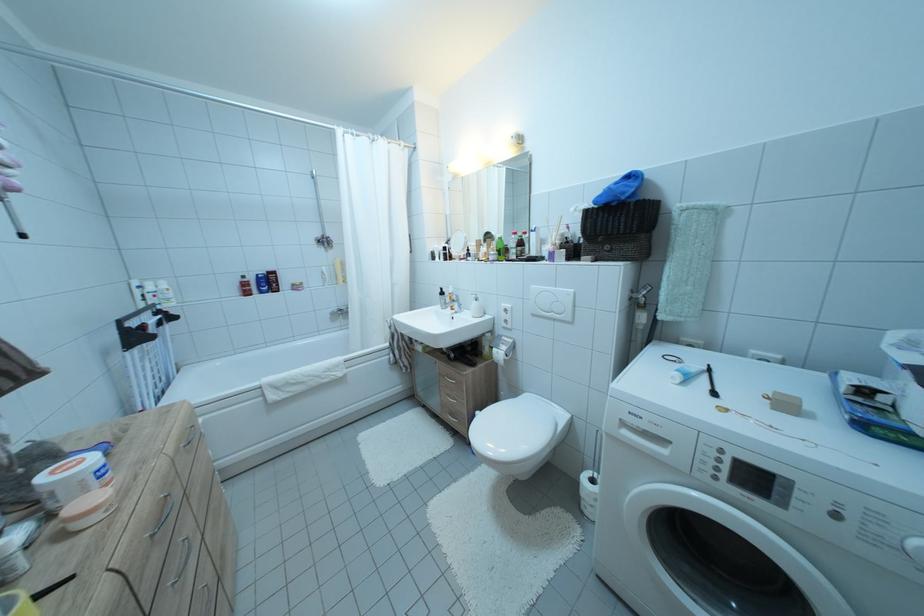
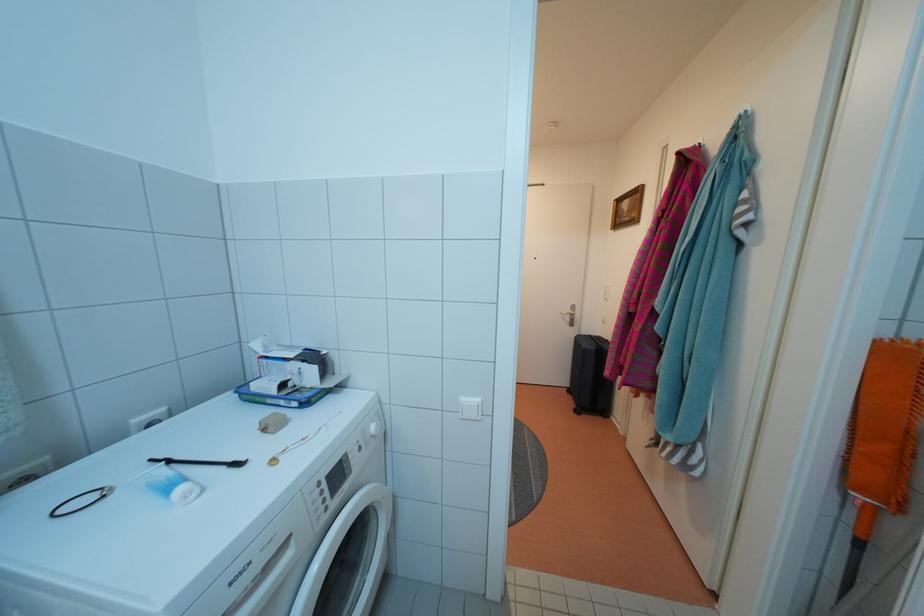
Where in the second image is the point corresponding to point (762, 485) from the first image?

(345, 482)